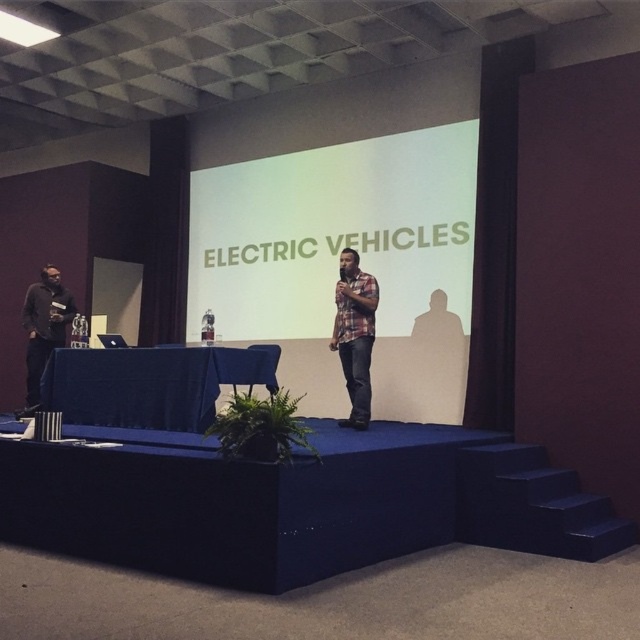
Question: Estimate the real-world distances between objects in this image. Which object is closer to the plaid shirt at center?

Choices:
 (A) white matte projection screen at center
 (B) matte black shirt at left

Answer: (A)

Question: Is white matte projection screen at center below plaid shirt at center?

Choices:
 (A) yes
 (B) no

Answer: (B)

Question: Can you confirm if white matte projection screen at center is positioned below plaid shirt at center?

Choices:
 (A) yes
 (B) no

Answer: (B)

Question: Which point is closer to the camera?

Choices:
 (A) (456, 176)
 (B) (52, 296)

Answer: (A)

Question: Can you confirm if white matte projection screen at center is positioned above plaid shirt at center?

Choices:
 (A) yes
 (B) no

Answer: (A)

Question: Estimate the real-world distances between objects in this image. Which object is closer to the plaid shirt at center?

Choices:
 (A) matte black shirt at left
 (B) white matte projection screen at center

Answer: (B)